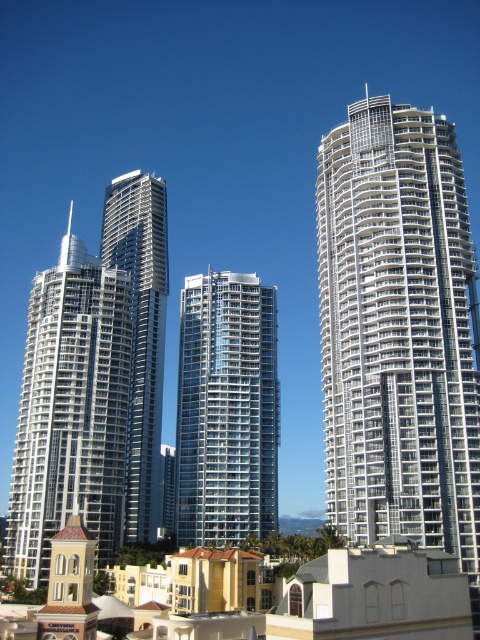
Does white glass building at center appear on the right side of white glass skyscraper at left?

Correct, you'll find white glass building at center to the right of white glass skyscraper at left.

Which is behind, point (459, 300) or point (34, 586)?

Point (34, 586)

Where is `white glass building at center`? white glass building at center is located at coordinates (397, 330).

Locate an element on the screen. This screenshot has width=480, height=640. white glass building at center is located at coordinates (397, 330).

Between glassy steel building at center and silver metallic skyscraper at center, which one is positioned higher?

silver metallic skyscraper at center is above.

Is glassy steel building at center smaller than silver metallic skyscraper at center?

Yes, glassy steel building at center is smaller than silver metallic skyscraper at center.

Between point (230, 508) and point (115, 186), which one is positioned in front?

Point (230, 508) is more forward.

Where is `glassy steel building at center`? This screenshot has height=640, width=480. glassy steel building at center is located at coordinates (227, 410).

Does point (118, 356) lie behind point (179, 500)?

No.

From the picture: Is white glass skyscraper at left shorter than glassy steel building at center?

Incorrect, white glass skyscraper at left's height does not fall short of glassy steel building at center's.

Locate an element on the screen. The height and width of the screenshot is (640, 480). white glass skyscraper at left is located at coordinates (71, 410).

I want to click on white glass skyscraper at left, so click(x=71, y=410).